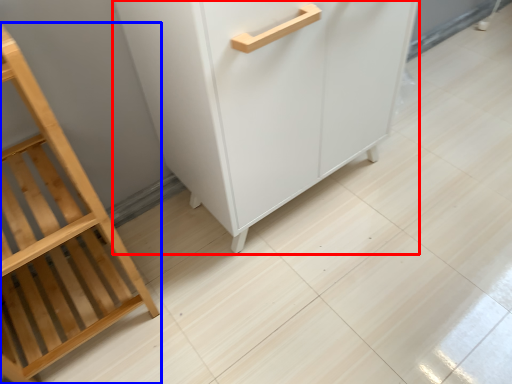
Question: Which object appears farthest to the camera in this image, cupboard (highlighted by a red box) or furniture (highlighted by a blue box)?

Choices:
 (A) cupboard
 (B) furniture

Answer: (A)